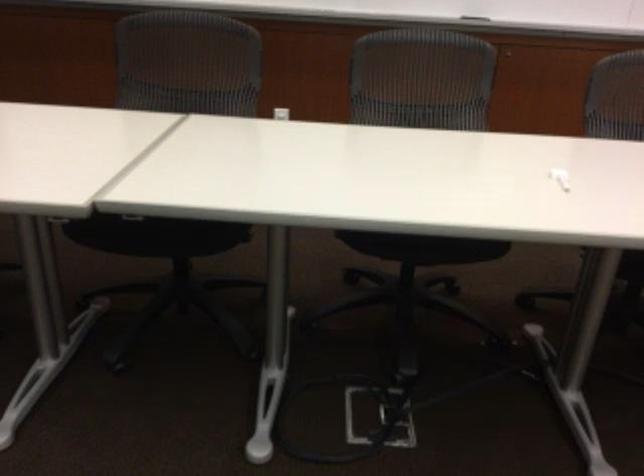
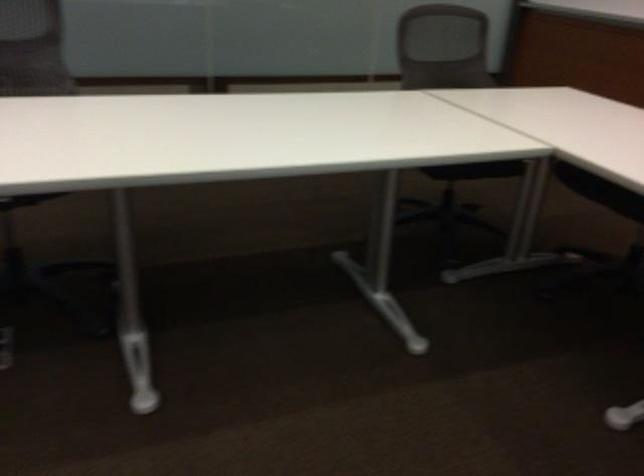
Question: The camera is either moving clockwise (left) or counter-clockwise (right) around the object. The first image is from the beginning of the video and the second image is from the end. Is the camera moving left or right when shooting the video?

Choices:
 (A) Left
 (B) Right

Answer: (B)